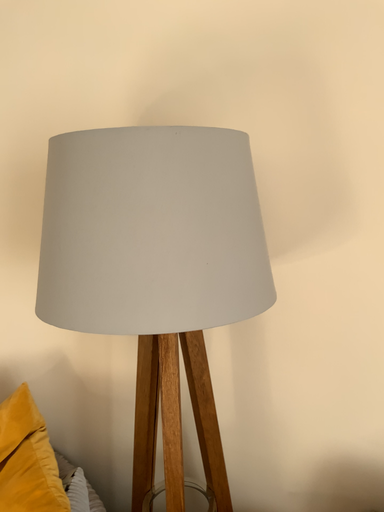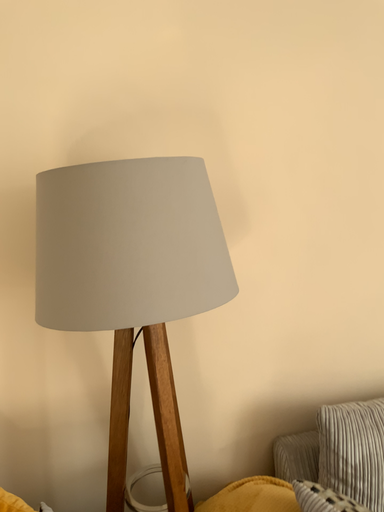
Question: Which way did the camera rotate in the video?

Choices:
 (A) rotated right
 (B) rotated left

Answer: (A)